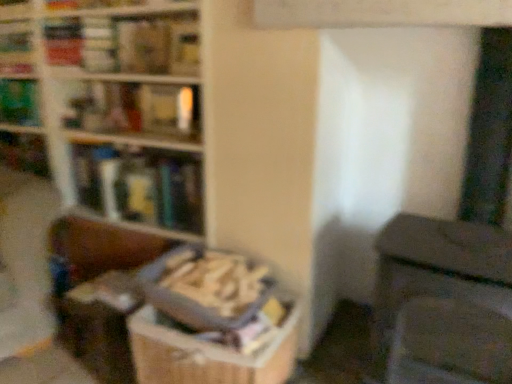
Question: From the image's perspective, would you say hardcover book at upper left, placed as the third book when sorted from bottom to top, is shown under green matte book at upper left, the fourth book from the bottom?

Choices:
 (A) no
 (B) yes

Answer: (B)

Question: Considering the relative sizes of hardcover book at upper left, placed as the third book when sorted from bottom to top, and green matte book at upper left, the fourth book from the bottom, in the image provided, is hardcover book at upper left, placed as the third book when sorted from bottom to top, wider than green matte book at upper left, the fourth book from the bottom,?

Choices:
 (A) yes
 (B) no

Answer: (B)

Question: Is hardcover book at upper left, which is counted as the third book, starting from the top, facing away from green matte book at upper left, the fourth book from the bottom?

Choices:
 (A) no
 (B) yes

Answer: (A)

Question: From a real-world perspective, is hardcover book at upper left, placed as the third book when sorted from bottom to top, physically above green matte book at upper left, which is counted as the second book, starting from the top?

Choices:
 (A) yes
 (B) no

Answer: (A)

Question: From the image's perspective, would you say hardcover book at upper left, which is counted as the third book, starting from the top, is positioned over green matte book at upper left, which is counted as the second book, starting from the top?

Choices:
 (A) no
 (B) yes

Answer: (A)

Question: Considering the positions of point (146, 269) and point (181, 87), is point (146, 269) closer or farther from the camera than point (181, 87)?

Choices:
 (A) farther
 (B) closer

Answer: (A)

Question: In the image, is wooden textured book at center, placed as the fifth book when sorted from top to bottom, on the left side or the right side of wooden bookcase at upper left?

Choices:
 (A) left
 (B) right

Answer: (B)

Question: Looking at their shapes, would you say wooden textured book at center, placed as the fifth book when sorted from top to bottom, is wider or thinner than wooden bookcase at upper left?

Choices:
 (A) wide
 (B) thin

Answer: (B)

Question: Would you say wooden textured book at center, placed as the fifth book when sorted from top to bottom, is inside or outside wooden bookcase at upper left?

Choices:
 (A) outside
 (B) inside

Answer: (A)

Question: Looking at their shapes, would you say wooden textured book at center, placed as the fifth book when sorted from top to bottom, is wider or thinner than hardcover book at upper left, which is counted as the third book, starting from the top?

Choices:
 (A) thin
 (B) wide

Answer: (B)

Question: In terms of size, does wooden textured book at center, which ranks as the 1th book in bottom-to-top order, appear bigger or smaller than hardcover book at upper left, placed as the third book when sorted from bottom to top?

Choices:
 (A) big
 (B) small

Answer: (A)

Question: Is wooden textured book at center, placed as the fifth book when sorted from top to bottom, inside or outside of hardcover book at upper left, placed as the third book when sorted from bottom to top?

Choices:
 (A) outside
 (B) inside

Answer: (A)

Question: Considering the positions of wooden textured book at center, which ranks as the 1th book in bottom-to-top order, and hardcover book at upper left, placed as the third book when sorted from bottom to top, in the image, is wooden textured book at center, which ranks as the 1th book in bottom-to-top order, taller or shorter than hardcover book at upper left, placed as the third book when sorted from bottom to top,?

Choices:
 (A) short
 (B) tall

Answer: (B)

Question: Choose the correct answer: Is hardcover book at upper left, which is counted as the third book, starting from the top, inside green matte book at upper left, the fourth book from the bottom, or outside it?

Choices:
 (A) inside
 (B) outside

Answer: (B)

Question: Is hardcover book at upper left, which is counted as the third book, starting from the top, to the left or to the right of green matte book at upper left, which is counted as the second book, starting from the top, in the image?

Choices:
 (A) right
 (B) left

Answer: (A)